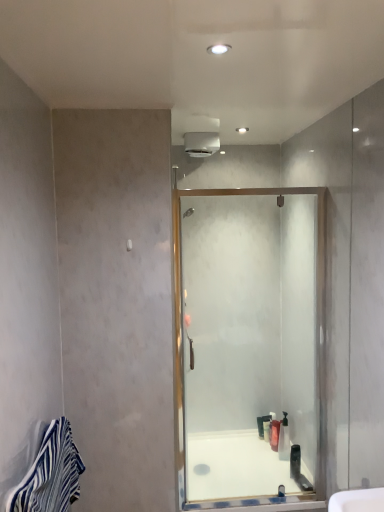
Question: Which direction should I rotate to look at translucent plastic bottle at center, marked as the second toiletry in a front-to-back arrangement?

Choices:
 (A) right
 (B) left

Answer: (A)

Question: Is clear glass shower door at center facing towards translucent plastic bottle at center, marked as the second toiletry in a front-to-back arrangement?

Choices:
 (A) yes
 (B) no

Answer: (B)

Question: Considering the relative positions of clear glass shower door at center and translucent plastic bottle at center, marked as the second toiletry in a front-to-back arrangement, in the image provided, is clear glass shower door at center to the right of translucent plastic bottle at center, marked as the second toiletry in a front-to-back arrangement, from the viewer's perspective?

Choices:
 (A) no
 (B) yes

Answer: (A)

Question: Is clear glass shower door at center smaller than translucent plastic bottle at center, the second toiletry positioned from the back?

Choices:
 (A) yes
 (B) no

Answer: (B)

Question: Considering the relative sizes of clear glass shower door at center and translucent plastic bottle at center, the second toiletry positioned from the back, in the image provided, is clear glass shower door at center wider than translucent plastic bottle at center, the second toiletry positioned from the back,?

Choices:
 (A) yes
 (B) no

Answer: (B)

Question: Does clear glass shower door at center appear on the left side of translucent plastic bottle at center, marked as the second toiletry in a front-to-back arrangement?

Choices:
 (A) no
 (B) yes

Answer: (B)

Question: From a real-world perspective, is clear glass shower door at center located higher than translucent plastic bottle at center, the second toiletry positioned from the back?

Choices:
 (A) yes
 (B) no

Answer: (A)

Question: Is blue striped towel at lower left positioned with its back to translucent plastic soap dispenser at center, placed as the 3th toiletry when sorted from back to front?

Choices:
 (A) yes
 (B) no

Answer: (B)

Question: Can you confirm if blue striped towel at lower left is wider than translucent plastic soap dispenser at center, placed as the 3th toiletry when sorted from back to front?

Choices:
 (A) yes
 (B) no

Answer: (A)

Question: Is blue striped towel at lower left closer to camera compared to translucent plastic soap dispenser at center, which is the first toiletry in front-to-back order?

Choices:
 (A) yes
 (B) no

Answer: (A)

Question: Is blue striped towel at lower left taller than translucent plastic soap dispenser at center, placed as the 3th toiletry when sorted from back to front?

Choices:
 (A) yes
 (B) no

Answer: (A)

Question: Is blue striped towel at lower left at the right side of translucent plastic soap dispenser at center, placed as the 3th toiletry when sorted from back to front?

Choices:
 (A) yes
 (B) no

Answer: (B)

Question: From the image's perspective, is blue striped towel at lower left under translucent plastic soap dispenser at center, placed as the 3th toiletry when sorted from back to front?

Choices:
 (A) yes
 (B) no

Answer: (B)

Question: From the image's perspective, does translucent plastic soap dispenser at center, which is the first toiletry in front-to-back order, appear lower than white glossy bath at center?

Choices:
 (A) no
 (B) yes

Answer: (A)